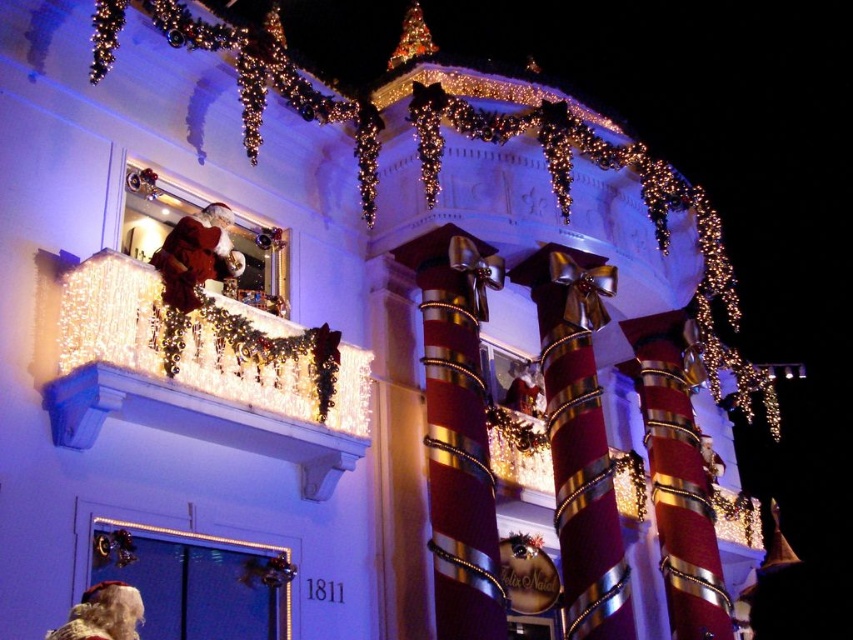
Could you measure the distance between illuminated glass balcony at upper center and illuminated white lights at balcony left?

illuminated glass balcony at upper center is 20.27 meters from illuminated white lights at balcony left.

This screenshot has height=640, width=853. I want to click on illuminated glass balcony at upper center, so click(x=195, y=380).

Identify the location of illuminated glass balcony at upper center. (195, 380).